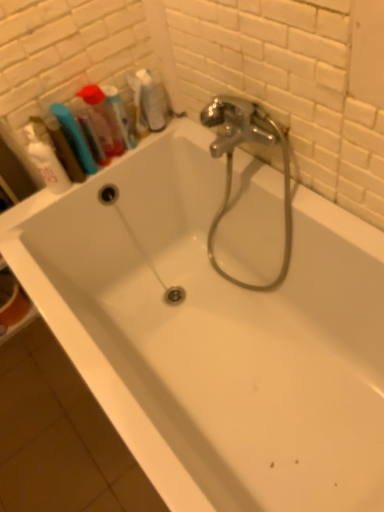
Locate an element on the screen. The height and width of the screenshot is (512, 384). translucent plastic container at upper left is located at coordinates (104, 119).

Looking at this image, considering the sizes of translucent plastic mouthwash at upper left, the first mouthwash when ordered from left to right, and translucent plastic mouthwash at upper left, placed as the 1th mouthwash when sorted from right to left, in the image, is translucent plastic mouthwash at upper left, the first mouthwash when ordered from left to right, wider or thinner than translucent plastic mouthwash at upper left, placed as the 1th mouthwash when sorted from right to left,?

In the image, translucent plastic mouthwash at upper left, the first mouthwash when ordered from left to right, appears to be wider than translucent plastic mouthwash at upper left, placed as the 1th mouthwash when sorted from right to left.

Considering the sizes of translucent plastic mouthwash at upper left, positioned as the third mouthwash in right-to-left order, and translucent plastic mouthwash at upper left, placed as the 1th mouthwash when sorted from right to left, in the image, is translucent plastic mouthwash at upper left, positioned as the third mouthwash in right-to-left order, bigger or smaller than translucent plastic mouthwash at upper left, placed as the 1th mouthwash when sorted from right to left,?

Clearly, translucent plastic mouthwash at upper left, positioned as the third mouthwash in right-to-left order, is larger in size than translucent plastic mouthwash at upper left, placed as the 1th mouthwash when sorted from right to left.

Which is further, (52, 130) or (116, 106)?

The point (116, 106) is farther.

Between translucent plastic mouthwash at upper left, the first mouthwash when ordered from left to right, and translucent plastic mouthwash at upper left, which appears as the 3th mouthwash when viewed from the left, which one appears on the right side from the viewer's perspective?

translucent plastic mouthwash at upper left, which appears as the 3th mouthwash when viewed from the left, is more to the right.

Which of these two, white matte shaving cream at upper left or translucent plastic container at upper left, is bigger?

translucent plastic container at upper left is bigger.

Which object is positioned more to the right, white matte shaving cream at upper left or translucent plastic container at upper left?

translucent plastic container at upper left is more to the right.

Is white matte shaving cream at upper left positioned behind translucent plastic container at upper left?

Yes.

Which object is thinner, white matte shaving cream at upper left or translucent plastic container at upper left?

translucent plastic container at upper left is thinner.

Between translucent plastic mouthwash at upper left, which appears as the 3th mouthwash when viewed from the left, and translucent plastic mouthwash at upper left, the 2th mouthwash when ordered from right to left, which one has larger width?

With larger width is translucent plastic mouthwash at upper left, the 2th mouthwash when ordered from right to left.

Considering the sizes of translucent plastic mouthwash at upper left, which appears as the 3th mouthwash when viewed from the left, and translucent plastic mouthwash at upper left, the 2th mouthwash when ordered from right to left, in the image, is translucent plastic mouthwash at upper left, which appears as the 3th mouthwash when viewed from the left, taller or shorter than translucent plastic mouthwash at upper left, the 2th mouthwash when ordered from right to left,?

translucent plastic mouthwash at upper left, which appears as the 3th mouthwash when viewed from the left, is shorter than translucent plastic mouthwash at upper left, the 2th mouthwash when ordered from right to left.

Which object is positioned more to the right, translucent plastic mouthwash at upper left, placed as the 1th mouthwash when sorted from right to left, or translucent plastic mouthwash at upper left, the 2th mouthwash when ordered from right to left?

From the viewer's perspective, translucent plastic mouthwash at upper left, placed as the 1th mouthwash when sorted from right to left, appears more on the right side.

Where is `mouthwash behind the translucent plastic mouthwash at upper left, the 2th mouthwash when ordered from right to left`? This screenshot has height=512, width=384. mouthwash behind the translucent plastic mouthwash at upper left, the 2th mouthwash when ordered from right to left is located at coordinates (120, 115).

Between translucent plastic mouthwash at upper left, which is counted as the second mouthwash, starting from the left, and translucent plastic mouthwash at upper left, which appears as the 3th mouthwash when viewed from the left, which one has smaller size?

Smaller between the two is translucent plastic mouthwash at upper left, which appears as the 3th mouthwash when viewed from the left.

Is translucent plastic mouthwash at upper left, which appears as the 3th mouthwash when viewed from the left, surrounded by translucent plastic mouthwash at upper left, which is counted as the second mouthwash, starting from the left?

No.

Find the location of a particular element. This screenshot has height=512, width=384. mouthwash behind the translucent plastic mouthwash at upper left, the 2th mouthwash when ordered from right to left is located at coordinates (120, 115).

Considering the points (103, 123) and (137, 71), which point is in front, point (103, 123) or point (137, 71)?

The point (103, 123) is more forward.

Which object is closer to the camera taking this photo, translucent plastic mouthwash at upper left, the 2th mouthwash when ordered from right to left, or translucent plastic container at upper left?

translucent plastic container at upper left is more forward.

The height and width of the screenshot is (512, 384). I want to click on toiletry in front of the translucent plastic mouthwash at upper left, the 2th mouthwash when ordered from right to left, so click(x=104, y=119).

From a real-world perspective, is translucent plastic mouthwash at upper left, which is counted as the second mouthwash, starting from the left, physically located above or below translucent plastic container at upper left?

translucent plastic mouthwash at upper left, which is counted as the second mouthwash, starting from the left, is situated lower than translucent plastic container at upper left in the real world.

Considering the relative sizes of translucent plastic mouthwash at upper left, positioned as the third mouthwash in right-to-left order, and white matte shaving cream at upper left in the image provided, is translucent plastic mouthwash at upper left, positioned as the third mouthwash in right-to-left order, taller than white matte shaving cream at upper left?

Answer: In fact, translucent plastic mouthwash at upper left, positioned as the third mouthwash in right-to-left order, may be shorter than white matte shaving cream at upper left.

Considering the relative sizes of translucent plastic mouthwash at upper left, the first mouthwash when ordered from left to right, and white matte shaving cream at upper left in the image provided, is translucent plastic mouthwash at upper left, the first mouthwash when ordered from left to right, wider than white matte shaving cream at upper left?

Indeed, translucent plastic mouthwash at upper left, the first mouthwash when ordered from left to right, has a greater width compared to white matte shaving cream at upper left.

Is point (72, 152) closer or farther from the camera than point (43, 178)?

Point (72, 152).

Is translucent plastic mouthwash at upper left, the first mouthwash when ordered from left to right, facing away from white matte shaving cream at upper left?

That's not correct — translucent plastic mouthwash at upper left, the first mouthwash when ordered from left to right, is not looking away from white matte shaving cream at upper left.

From the image's perspective, is translucent plastic mouthwash at upper left, the 2th mouthwash when ordered from right to left, positioned above or below translucent plastic mouthwash at upper left, positioned as the third mouthwash in right-to-left order?

From the image's perspective, translucent plastic mouthwash at upper left, the 2th mouthwash when ordered from right to left, appears above translucent plastic mouthwash at upper left, positioned as the third mouthwash in right-to-left order.

In terms of width, does translucent plastic mouthwash at upper left, which is counted as the second mouthwash, starting from the left, look wider or thinner when compared to translucent plastic mouthwash at upper left, positioned as the third mouthwash in right-to-left order?

Clearly, translucent plastic mouthwash at upper left, which is counted as the second mouthwash, starting from the left, has less width compared to translucent plastic mouthwash at upper left, positioned as the third mouthwash in right-to-left order.

Is translucent plastic mouthwash at upper left, the 2th mouthwash when ordered from right to left, positioned with its back to translucent plastic mouthwash at upper left, positioned as the third mouthwash in right-to-left order?

No, translucent plastic mouthwash at upper left, the 2th mouthwash when ordered from right to left,'s orientation is not away from translucent plastic mouthwash at upper left, positioned as the third mouthwash in right-to-left order.

Find the location of a particular element. This screenshot has height=512, width=384. the 1st mouthwash directly above the translucent plastic mouthwash at upper left, positioned as the third mouthwash in right-to-left order (from a real-world perspective) is located at coordinates (120, 115).

Where is `toiletry to the right of white matte shaving cream at upper left`? This screenshot has height=512, width=384. toiletry to the right of white matte shaving cream at upper left is located at coordinates (104, 119).

Which object lies nearer to the anchor point translucent plastic mouthwash at upper left, positioned as the third mouthwash in right-to-left order, translucent plastic container at upper left or white matte shaving cream at upper left?

white matte shaving cream at upper left is positioned closer to the anchor translucent plastic mouthwash at upper left, positioned as the third mouthwash in right-to-left order.

From the image, which object appears to be nearer to translucent plastic mouthwash at upper left, placed as the 1th mouthwash when sorted from right to left, translucent plastic mouthwash at upper left, which is counted as the second mouthwash, starting from the left, or translucent plastic mouthwash at upper left, positioned as the third mouthwash in right-to-left order?

translucent plastic mouthwash at upper left, which is counted as the second mouthwash, starting from the left, is positioned closer to the anchor translucent plastic mouthwash at upper left, placed as the 1th mouthwash when sorted from right to left.

From the image, which object appears to be farther from white matte shaving cream at upper left, translucent plastic container at upper left or translucent plastic mouthwash at upper left, which appears as the 3th mouthwash when viewed from the left?

translucent plastic mouthwash at upper left, which appears as the 3th mouthwash when viewed from the left, is positioned further to the anchor white matte shaving cream at upper left.

From the picture: Based on their spatial positions, is translucent plastic mouthwash at upper left, positioned as the third mouthwash in right-to-left order, or white matte shaving cream at upper left further from translucent plastic container at upper left?

The object further to translucent plastic container at upper left is white matte shaving cream at upper left.

Which object lies further to the anchor point translucent plastic container at upper left, translucent plastic mouthwash at upper left, placed as the 1th mouthwash when sorted from right to left, or translucent plastic mouthwash at upper left, which is counted as the second mouthwash, starting from the left?

Result: translucent plastic mouthwash at upper left, placed as the 1th mouthwash when sorted from right to left.

From the picture: Which object lies nearer to the anchor point white matte shaving cream at upper left, translucent plastic container at upper left or translucent plastic mouthwash at upper left, the 2th mouthwash when ordered from right to left?

translucent plastic mouthwash at upper left, the 2th mouthwash when ordered from right to left, lies closer to white matte shaving cream at upper left than the other object.

Considering their positions, is translucent plastic mouthwash at upper left, which is counted as the second mouthwash, starting from the left, positioned closer to translucent plastic container at upper left than translucent plastic mouthwash at upper left, the first mouthwash when ordered from left to right?

translucent plastic mouthwash at upper left, which is counted as the second mouthwash, starting from the left, lies closer to translucent plastic container at upper left than the other object.

Looking at the image, which one is located closer to translucent plastic mouthwash at upper left, which is counted as the second mouthwash, starting from the left, white matte shaving cream at upper left or translucent plastic container at upper left?

The object closer to translucent plastic mouthwash at upper left, which is counted as the second mouthwash, starting from the left, is translucent plastic container at upper left.

You are a GUI agent. You are given a task and a screenshot of the screen. Output one action in this format:
    pyautogui.click(x=<x>, y=<y>)
    Task: Click on the shaving cream positioned between translucent plastic container at upper left and translucent plastic mouthwash at upper left, which appears as the 3th mouthwash when viewed from the left, from near to far
    This screenshot has width=384, height=512.
    Given the screenshot: What is the action you would take?
    pyautogui.click(x=46, y=162)

You are a GUI agent. You are given a task and a screenshot of the screen. Output one action in this format:
    pyautogui.click(x=<x>, y=<y>)
    Task: Click on the mouthwash located between translucent plastic container at upper left and translucent plastic mouthwash at upper left, the 2th mouthwash when ordered from right to left, in the depth direction
    The height and width of the screenshot is (512, 384).
    Given the screenshot: What is the action you would take?
    pyautogui.click(x=63, y=149)

This screenshot has height=512, width=384. In order to click on mouthwash between white matte shaving cream at upper left and translucent plastic mouthwash at upper left, which is counted as the second mouthwash, starting from the left in this screenshot , I will do `click(63, 149)`.

The height and width of the screenshot is (512, 384). Identify the location of mouthwash situated between translucent plastic mouthwash at upper left, the first mouthwash when ordered from left to right, and translucent plastic mouthwash at upper left, placed as the 1th mouthwash when sorted from right to left, from left to right. (102, 120).